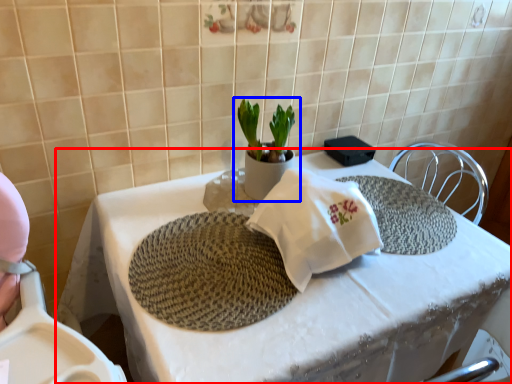
Question: Which point is closer to the camera, table (highlighted by a red box) or houseplant (highlighted by a blue box)?

Choices:
 (A) table
 (B) houseplant

Answer: (A)